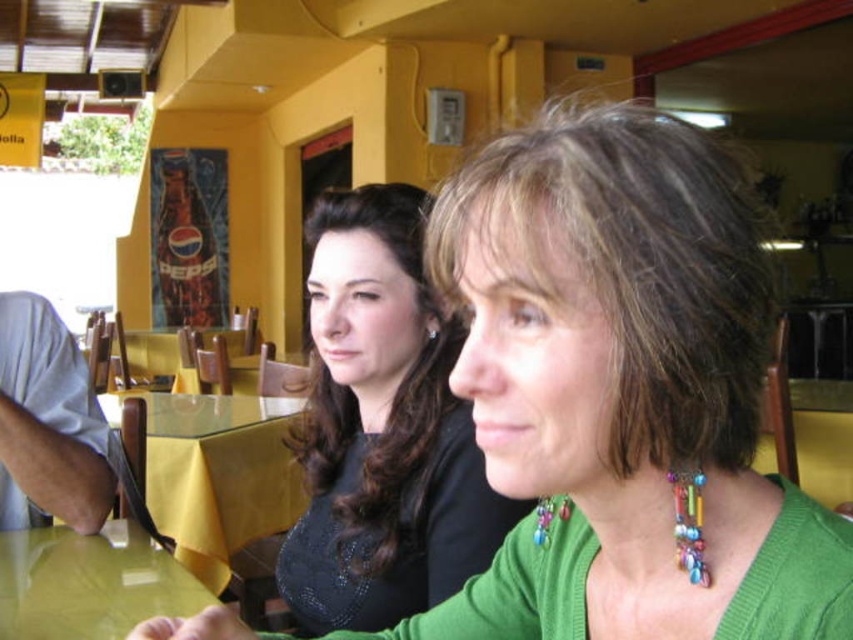
Is green matte sweater at center behind glossy yellow table at lower left?

No, green matte sweater at center is closer to the viewer.

Does green matte sweater at center appear on the left side of glossy yellow table at lower left?

Incorrect, green matte sweater at center is not on the left side of glossy yellow table at lower left.

Identify the location of green matte sweater at center. This screenshot has width=853, height=640. (624, 392).

Identify the location of green matte sweater at center. (624, 392).

Is point (556, 458) closer to camera compared to point (368, 611)?

Yes, point (556, 458) is closer to viewer.

Locate an element on the screen. The image size is (853, 640). green matte sweater at center is located at coordinates (624, 392).

At what (x,y) coordinates should I click in order to perform the action: click on green matte sweater at center. Please return your answer as a coordinate pair (x, y). The height and width of the screenshot is (640, 853). Looking at the image, I should click on (624, 392).

Which is above, black glossy hair at center or multicolored beads necklace at center?

black glossy hair at center is above.

Is black glossy hair at center to the right of multicolored beads necklace at center from the viewer's perspective?

No, black glossy hair at center is not to the right of multicolored beads necklace at center.

Does point (345, 541) come behind point (695, 547)?

Yes, it is behind point (695, 547).

Identify the location of black glossy hair at center. Image resolution: width=853 pixels, height=640 pixels. (381, 428).